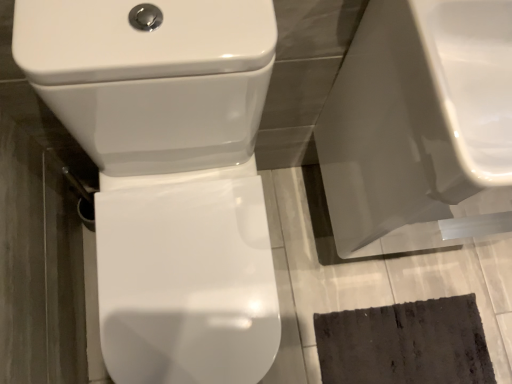
Question: Are white glossy toilet seat at center and white glossy toilet at center far apart?

Choices:
 (A) yes
 (B) no

Answer: (B)

Question: Is white glossy toilet seat at center at the left side of white glossy toilet at center?

Choices:
 (A) no
 (B) yes

Answer: (A)

Question: Is white glossy toilet seat at center outside of white glossy toilet at center?

Choices:
 (A) yes
 (B) no

Answer: (A)

Question: Is white glossy toilet seat at center oriented towards white glossy toilet at center?

Choices:
 (A) no
 (B) yes

Answer: (A)

Question: Is white glossy toilet seat at center smaller than white glossy toilet at center?

Choices:
 (A) yes
 (B) no

Answer: (A)

Question: From a real-world perspective, is white glossy toilet seat at center located beneath white glossy toilet at center?

Choices:
 (A) no
 (B) yes

Answer: (B)

Question: From a real-world perspective, is white glossy toilet seat at center located beneath glossy ceramic sink at upper right?

Choices:
 (A) yes
 (B) no

Answer: (A)

Question: Does white glossy toilet seat at center contain glossy ceramic sink at upper right?

Choices:
 (A) yes
 (B) no

Answer: (B)

Question: Would you say white glossy toilet seat at center is outside glossy ceramic sink at upper right?

Choices:
 (A) no
 (B) yes

Answer: (B)

Question: Is white glossy toilet seat at center bigger than glossy ceramic sink at upper right?

Choices:
 (A) no
 (B) yes

Answer: (A)

Question: From the image's perspective, is white glossy toilet seat at center over glossy ceramic sink at upper right?

Choices:
 (A) yes
 (B) no

Answer: (B)

Question: Is white glossy toilet seat at center thinner than glossy ceramic sink at upper right?

Choices:
 (A) yes
 (B) no

Answer: (B)

Question: From the image's perspective, is white glossy toilet at center under white glossy toilet seat at center?

Choices:
 (A) yes
 (B) no

Answer: (B)